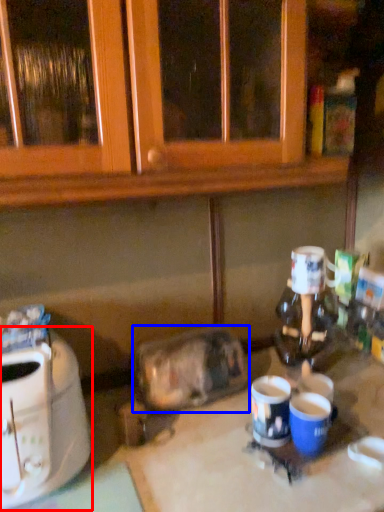
Question: Which object is further to the camera taking this photo, toaster (highlighted by a red box) or appliance (highlighted by a blue box)?

Choices:
 (A) toaster
 (B) appliance

Answer: (B)